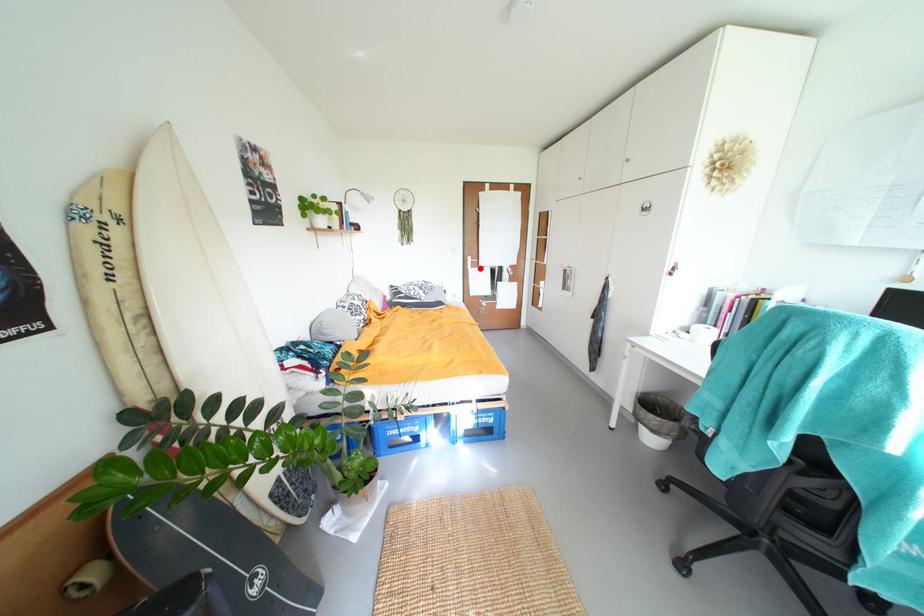
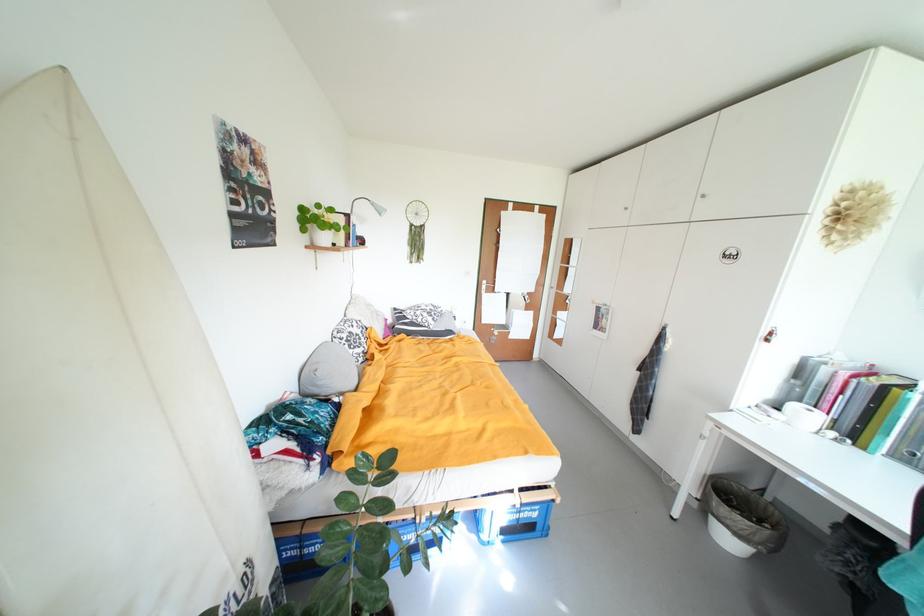
Where in the second image is the point corresponding to the highlighted location from the first image?

(494, 294)